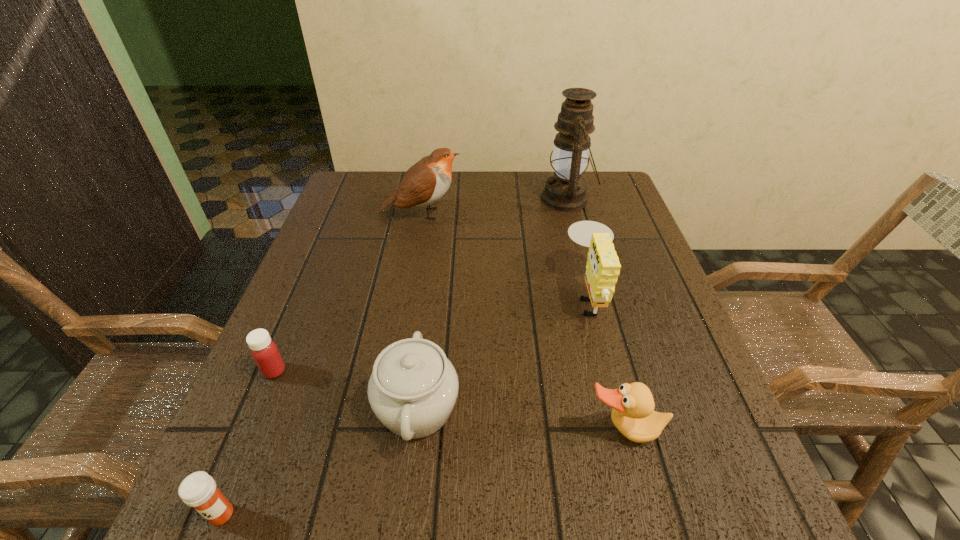
Find the location of a particular element. free region located on the front-facing side of the fifth shortest object is located at coordinates (479, 295).

This screenshot has height=540, width=960. Find the location of `vacant area situated on the front-facing side of the fifth shortest object`. vacant area situated on the front-facing side of the fifth shortest object is located at coordinates (423, 295).

Locate an element on the screen. Image resolution: width=960 pixels, height=540 pixels. vacant region located on the front-facing side of the fifth shortest object is located at coordinates (437, 295).

You are a GUI agent. You are given a task and a screenshot of the screen. Output one action in this format:
    pyautogui.click(x=<x>, y=<y>)
    Task: Click on the blank space located on the right of the chinaware
    
    Given the screenshot: What is the action you would take?
    pyautogui.click(x=507, y=408)

Find the location of a particular element. free space located 0.130m on the beak of the duck is located at coordinates (653, 539).

Locate an element on the screen. The height and width of the screenshot is (540, 960). vacant region located on the front of the farther medicine is located at coordinates (228, 482).

Identify the location of oil lamp that is at the far edge. (565, 191).

Locate an element on the screen. Image resolution: width=960 pixels, height=540 pixels. bird present at the far edge is located at coordinates (427, 181).

Locate an element on the screen. The image size is (960, 540). object that is at the near edge is located at coordinates (198, 490).

The width and height of the screenshot is (960, 540). I want to click on bird that is at the left edge, so click(427, 181).